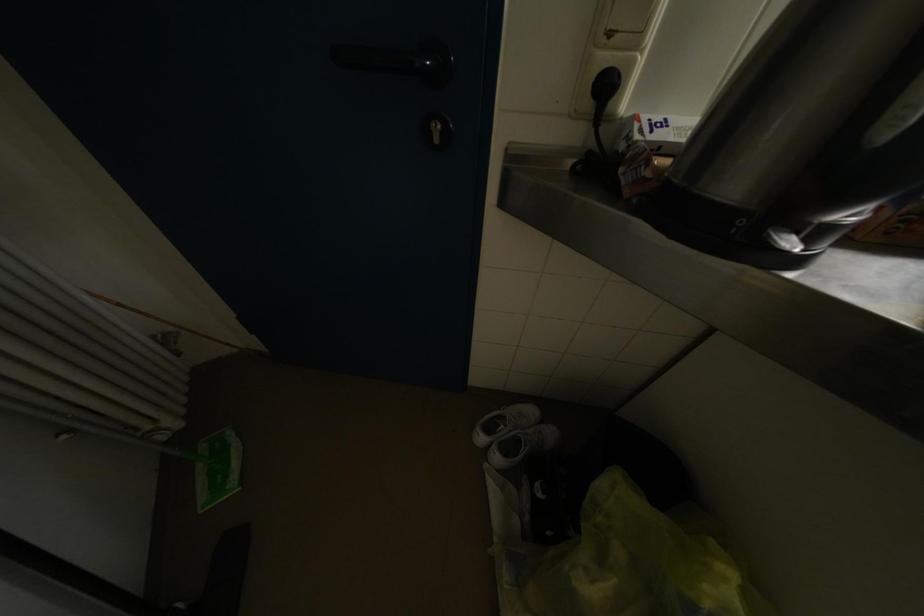
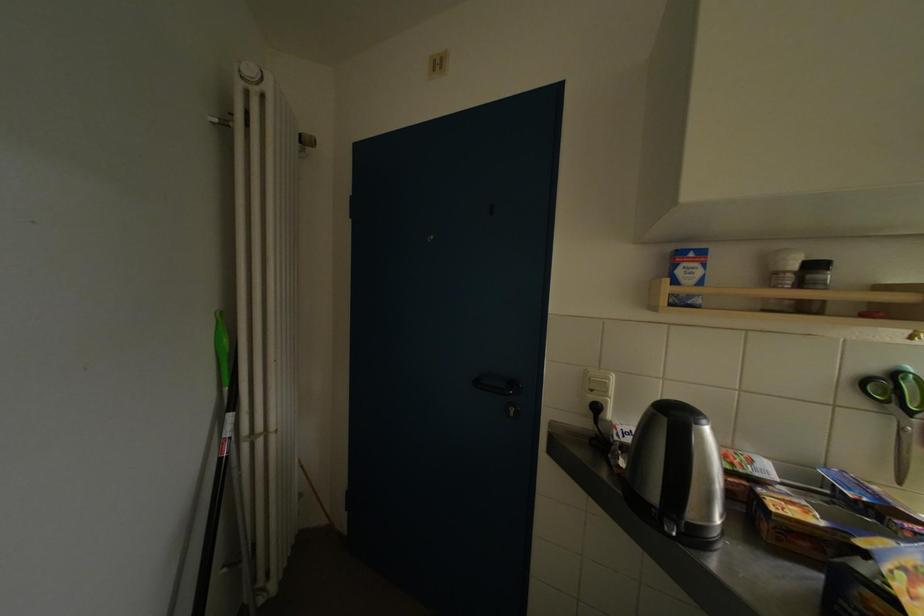
The point at (617,38) is marked in the first image. Where is the corresponding point in the second image?

(599, 394)